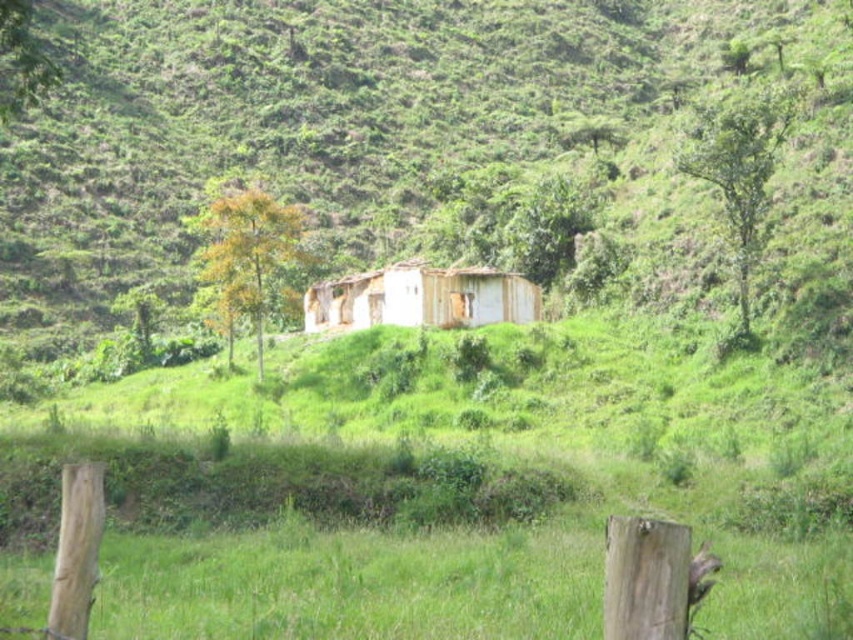
You are a delivery drone flying over a rural area. You need to land at the rusty metal shack at center. What are the coordinates to land?

The coordinates to land at the rusty metal shack at center are point (312, 116).

You are a photographer standing at a safe distance from the rusty metal shack at center. You want to capture a clear photo of the shack without any obstructions. Considering the distance, can you estimate how far you should stand to ensure the entire structure fits in your camera frame?

The rusty metal shack at center is 30.82 meters away from the camera. To ensure the entire structure fits in the frame, you should position yourself approximately 30.82 meters away from the shack.

You are a hiker who wants to take shelter from a sudden rainstorm. You see the rusty metal shack at center and the white wooden hut at center. Which structure is taller and thus might provide better protection from the rain?

The rusty metal shack at center is taller than the white wooden hut at center, so it might provide better protection from the rain.